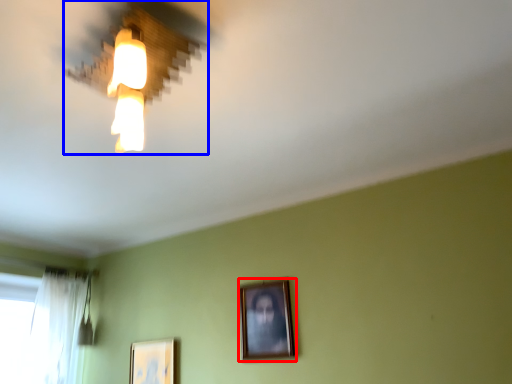
Question: Which object appears farthest to the camera in this image, picture frame (highlighted by a red box) or lamp (highlighted by a blue box)?

Choices:
 (A) picture frame
 (B) lamp

Answer: (A)